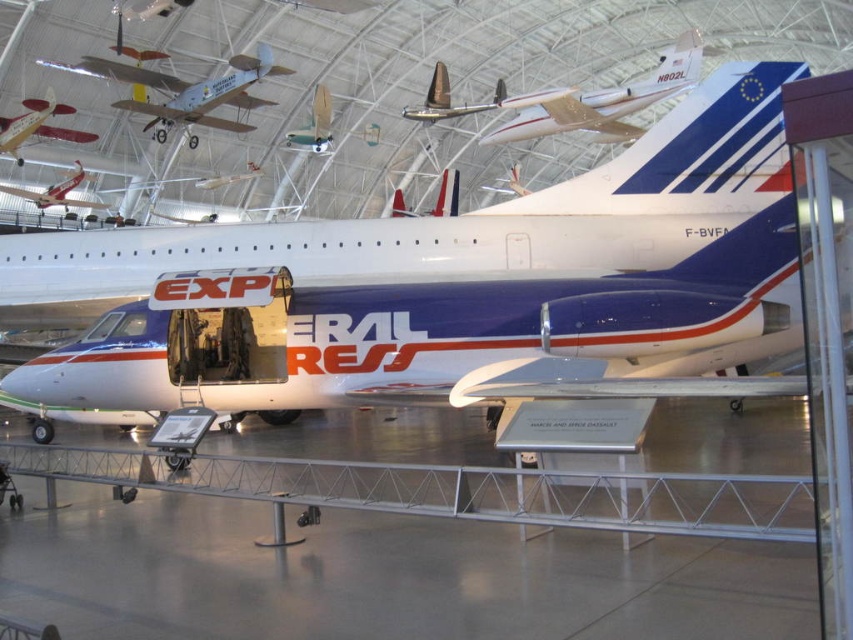
You are a tour guide leading a group through the aviation museum. You need to move a 15 feet wide banner between the white glossy airplane at center and the matte red airplane at upper left. Can you fit the banner between them without touching either airplane?

The white glossy airplane at center is 16.52 feet from the matte red airplane at upper left. Since the banner is 15 feet wide, it can fit between them as the distance is greater than the banner width.

You are a tour guide giving a tour of the aviation museum. You want to move from the entrance to the shiny silver airplane at center. There is a matte red airplane at upper left blocking the path. Can you walk around it? Explain your reasoning.

The matte red airplane at upper left is 20.81 feet away from the shiny silver airplane at center. Since the distance between them allows for a clear path, you can walk around the matte red airplane at upper left to reach the shiny silver airplane at center.